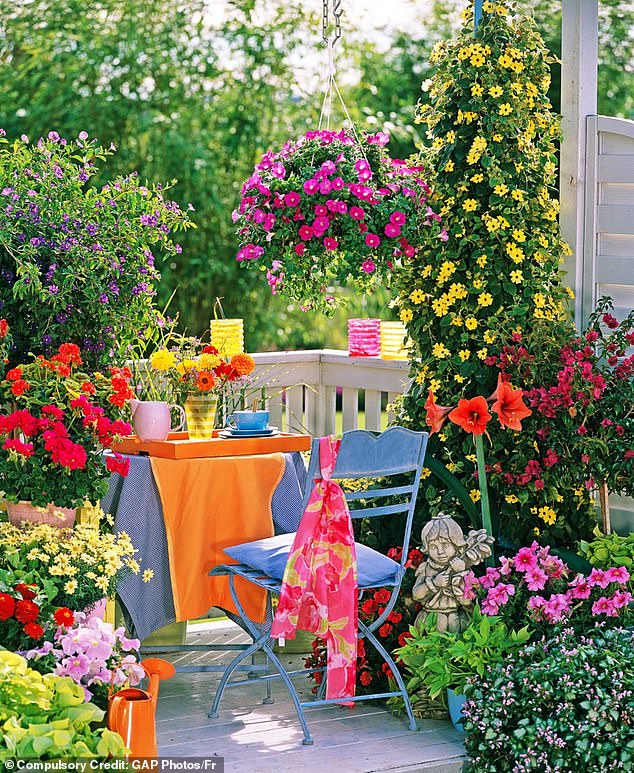
Where is `tablecloth`? This screenshot has height=773, width=634. tablecloth is located at coordinates (204, 494), (119, 504), (286, 499).